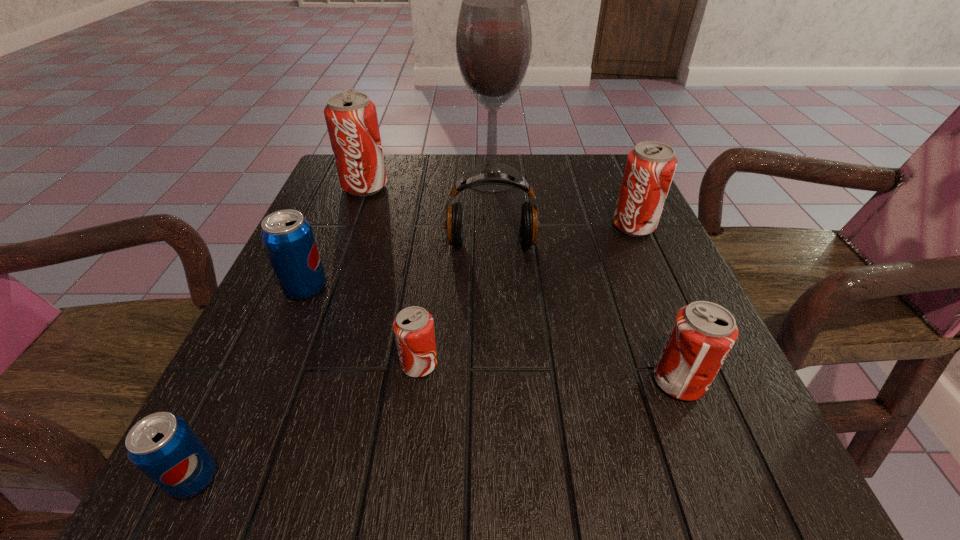
Where is `free area in between the nearest object and the red alcohol`? The height and width of the screenshot is (540, 960). free area in between the nearest object and the red alcohol is located at coordinates (343, 327).

This screenshot has height=540, width=960. Identify the location of free space between the second pink soda can from left to right and the third biggest pink soda can. (549, 373).

The image size is (960, 540). Find the location of `vacant area that lies between the second pink soda can from left to right and the headset`. vacant area that lies between the second pink soda can from left to right and the headset is located at coordinates (455, 305).

Where is `free point between the headset and the farthest pink soda can`? free point between the headset and the farthest pink soda can is located at coordinates (428, 215).

Identify which object is the seventh closest to the second pink soda can from left to right. Please provide its 2D coordinates. Your answer should be formatted as a tuple, i.e. [(x, y)], where the tuple contains the x and y coordinates of a point satisfying the conditions above.

[(494, 38)]

Choose which object is the fifth nearest neighbor to the farthest pink soda can. Please provide its 2D coordinates. Your answer should be formatted as a tuple, i.e. [(x, y)], where the tuple contains the x and y coordinates of a point satisfying the conditions above.

[(650, 167)]

Select which pop soda is the second closest to the second smallest pink soda can. Please provide its 2D coordinates. Your answer should be formatted as a tuple, i.e. [(x, y)], where the tuple contains the x and y coordinates of a point satisfying the conditions above.

[(413, 327)]

Identify the location of pop soda that can be found as the second closest to the smaller blue pop soda. (287, 236).

Image resolution: width=960 pixels, height=540 pixels. Find the location of `pink soda can that stands as the second closest to the second biggest pink soda can`. pink soda can that stands as the second closest to the second biggest pink soda can is located at coordinates (413, 327).

Locate an element on the screen. pink soda can that is the second closest to the third pop soda from right to left is located at coordinates (650, 167).